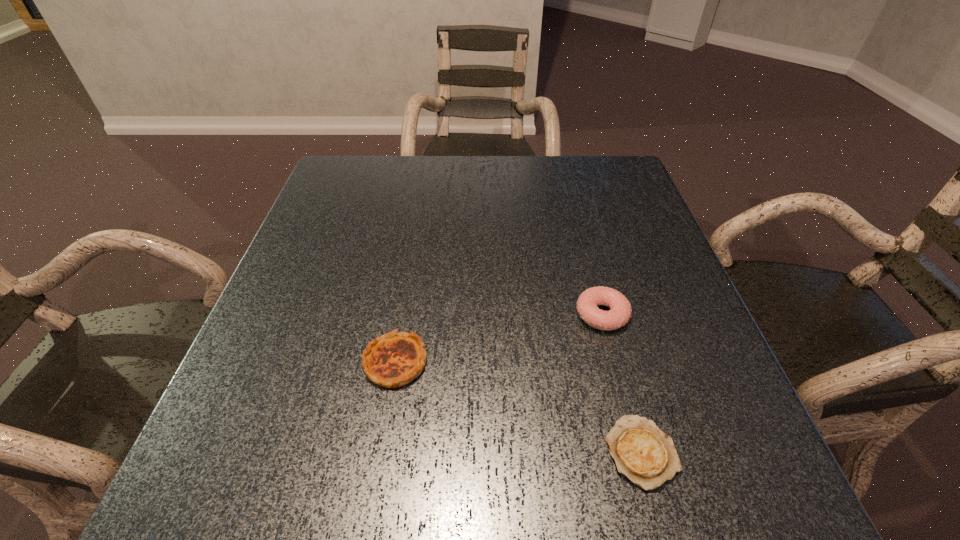
The image size is (960, 540). I want to click on doughnut, so click(620, 313).

Locate an element on the screen. The width and height of the screenshot is (960, 540). the farthest object is located at coordinates (620, 313).

You are a GUI agent. You are given a task and a screenshot of the screen. Output one action in this format:
    pyautogui.click(x=<x>, y=<y>)
    Task: Click on the taller quiche
    The image size is (960, 540).
    Given the screenshot: What is the action you would take?
    pyautogui.click(x=394, y=359)

At what (x,y) coordinates should I click in order to perform the action: click on the leftmost object. Please return your answer as a coordinate pair (x, y). This screenshot has width=960, height=540. Looking at the image, I should click on (394, 359).

Find the location of a particular element. The image size is (960, 540). the shortest object is located at coordinates (642, 452).

You are a GUI agent. You are given a task and a screenshot of the screen. Output one action in this format:
    pyautogui.click(x=<x>, y=<y>)
    Task: Click on the shorter quiche
    The image size is (960, 540).
    Given the screenshot: What is the action you would take?
    pyautogui.click(x=642, y=452)

Image resolution: width=960 pixels, height=540 pixels. In order to click on vacant space located on the front of the farthest object in this screenshot , I will do `click(641, 464)`.

At what (x,y) coordinates should I click in order to perform the action: click on vacant space located on the back of the left quiche. Please return your answer as a coordinate pair (x, y). Looking at the image, I should click on (413, 255).

At what (x,y) coordinates should I click in order to perform the action: click on vacant region located 0.130m on the left of the nearest object. Please return your answer as a coordinate pair (x, y). The image size is (960, 540). Looking at the image, I should click on (520, 451).

Where is `object located in the near edge section of the desktop`? object located in the near edge section of the desktop is located at coordinates (642, 452).